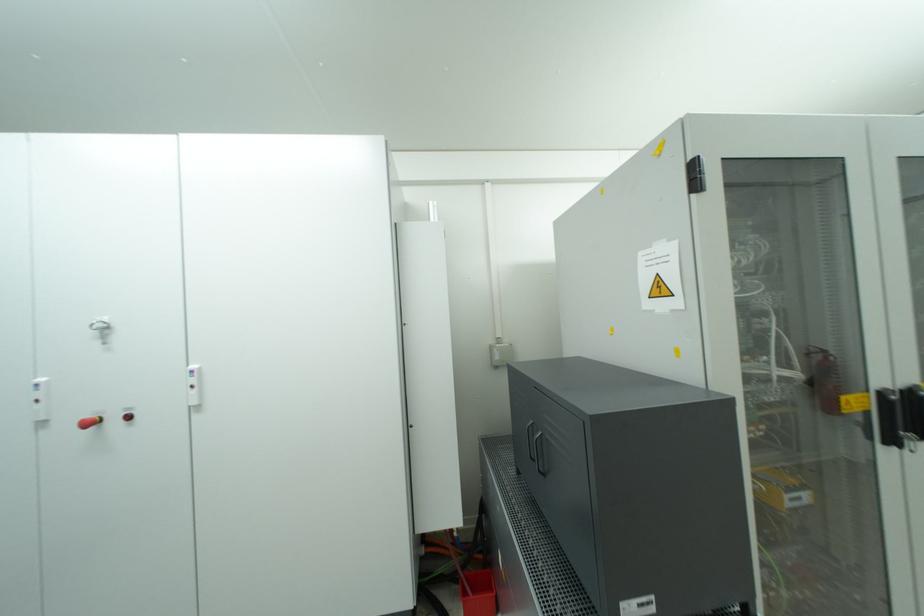
Find the location of a particular element. The height and width of the screenshot is (616, 924). red emergency button is located at coordinates (90, 421).